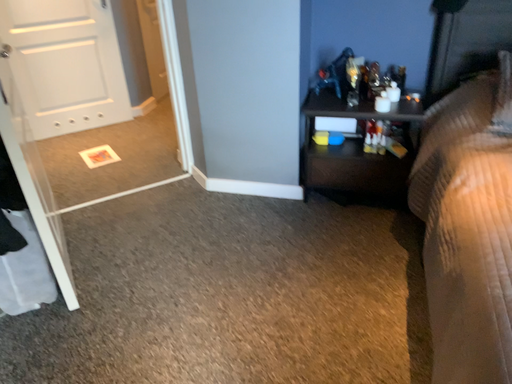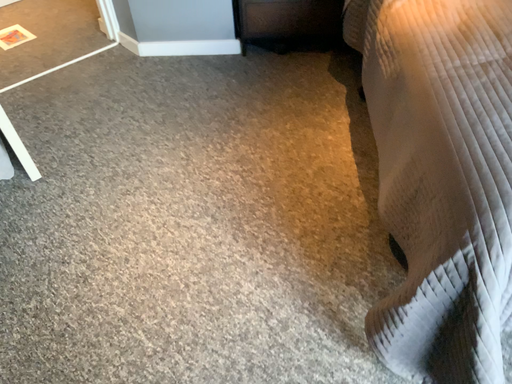
Question: Which way did the camera rotate in the video?

Choices:
 (A) rotated left
 (B) rotated right

Answer: (B)